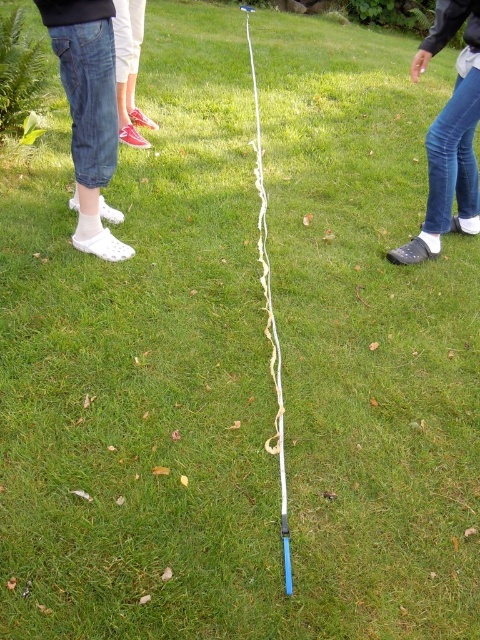
Question: Which point is farther from the camera taking this photo?

Choices:
 (A) (123, 36)
 (B) (79, 3)
 (C) (271, 323)

Answer: (A)

Question: Can you confirm if white fabric socks at left is thinner than blue denim jeans at lower right?

Choices:
 (A) no
 (B) yes

Answer: (B)

Question: In this image, where is white fabric socks at left located relative to pink fabric shoe at upper left?

Choices:
 (A) below
 (B) above

Answer: (A)

Question: Estimate the real-world distances between objects in this image. Which object is farther from the blue denim jeans at lower right?

Choices:
 (A) white fabric string at center
 (B) pink fabric shoe at upper left
 (C) white fabric socks at left

Answer: (B)

Question: Estimate the real-world distances between objects in this image. Which object is farther from the pink fabric shoe at upper left?

Choices:
 (A) white fabric socks at left
 (B) blue denim jeans at lower right
 (C) white fabric string at center

Answer: (B)

Question: Is white fabric socks at left to the left of pink fabric shoe at upper left from the viewer's perspective?

Choices:
 (A) no
 (B) yes

Answer: (B)